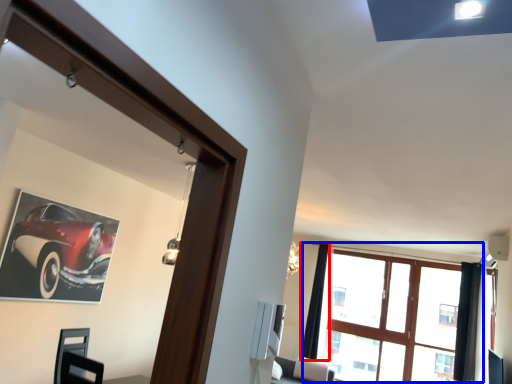
Question: Which object is further to the camera taking this photo, curtain (highlighted by a red box) or window (highlighted by a blue box)?

Choices:
 (A) curtain
 (B) window

Answer: (A)